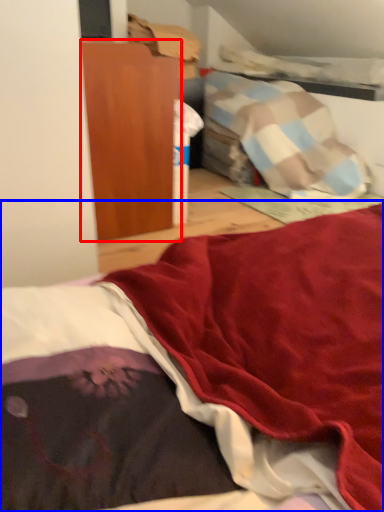
Question: Which point is further to the camera, furniture (highlighted by a red box) or bed (highlighted by a blue box)?

Choices:
 (A) furniture
 (B) bed

Answer: (A)